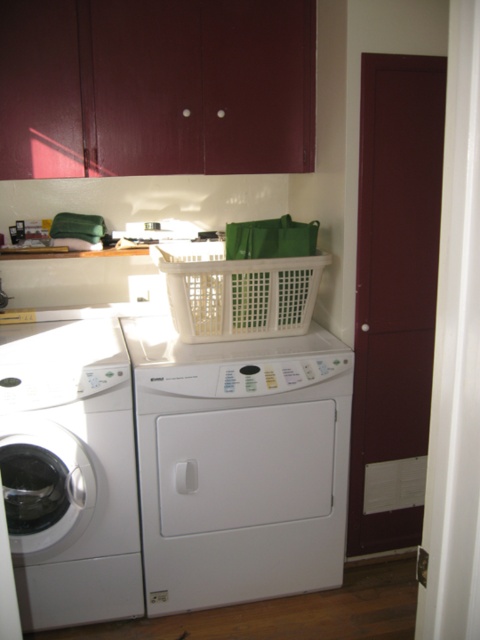
You are a delivery person who just delivered a new laundry basket that is 14 inches wide. You want to place it between the white plastic washing machine at center and the white plastic basket at center. Is there enough space between them to fit the new basket?

The distance between the white plastic washing machine at center and the white plastic basket at center is 14.22 inches. Since the new basket is 14 inches wide, there is enough space to fit it between them with a small gap remaining.

You are standing in the laundry room and want to reach both points. Which point, point (124, 397) or point (206, 339), will you need to stretch your arm less to touch?

Point (124, 397) is closer to the camera than point (206, 339), so you will need to stretch your arm less to touch point (124, 397).

You are trying to move the white plastic washing machine at center to the left side of the room. Can you fit it next to the white glossy washing machine at left without removing any other appliances?

The white plastic washing machine at center might be wider than the white glossy washing machine at left, so there might not be enough space to fit them side by side without removing other appliances.